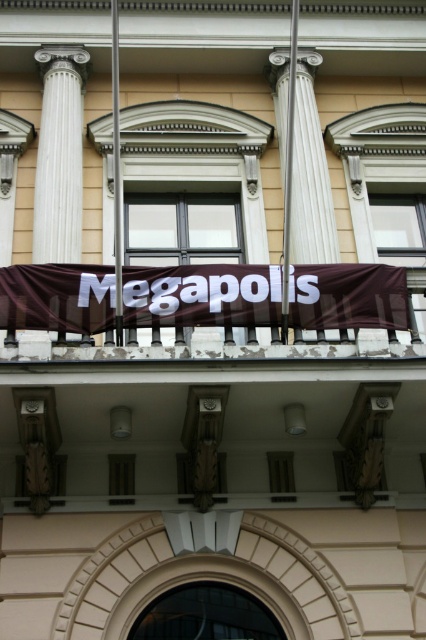
Question: Which object appears closest to the camera in this image?

Choices:
 (A) white marble pillar at center
 (B) white marble column at left
 (C) metallic silver pole at center

Answer: (C)

Question: Does white marble column at left have a smaller size compared to white marble pillar at center?

Choices:
 (A) yes
 (B) no

Answer: (A)

Question: Considering the relative positions of white marble pillar at center and metallic silver pole at center in the image provided, where is white marble pillar at center located with respect to metallic silver pole at center?

Choices:
 (A) left
 (B) right

Answer: (B)

Question: Estimate the real-world distances between objects in this image. Which object is farther from the white marble pillar at center?

Choices:
 (A) metallic silver pole at center
 (B) metallic flagpole at upper center
 (C) brown fabric banner at center
 (D) white marble column at left

Answer: (D)

Question: Which point is closer to the camera?

Choices:
 (A) (117, 170)
 (B) (279, 115)

Answer: (A)

Question: Does white marble pillar at center have a larger size compared to metallic flagpole at upper center?

Choices:
 (A) no
 (B) yes

Answer: (A)